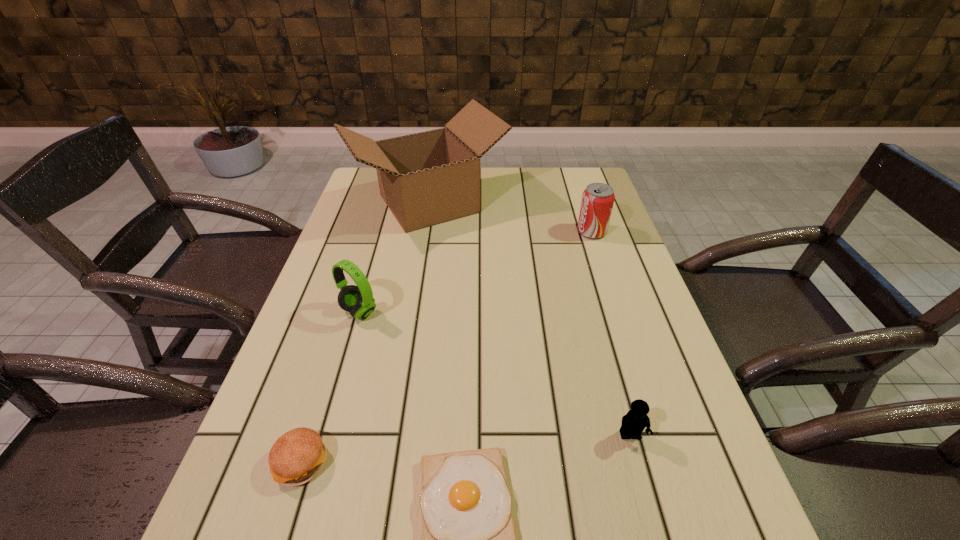
The width and height of the screenshot is (960, 540). In order to click on object positioned at the far edge in this screenshot , I will do `click(428, 178)`.

I want to click on box located at the left edge, so click(x=428, y=178).

You are a GUI agent. You are given a task and a screenshot of the screen. Output one action in this format:
    pyautogui.click(x=<x>, y=<y>)
    Task: Click on the headset that is at the left edge
    The image size is (960, 540).
    Given the screenshot: What is the action you would take?
    click(358, 300)

This screenshot has width=960, height=540. Identify the location of hamburger at the left edge. (297, 456).

Where is `soda can at the right edge`? This screenshot has width=960, height=540. soda can at the right edge is located at coordinates (597, 202).

This screenshot has height=540, width=960. What are the coordinates of `Lego located in the right edge section of the desktop` in the screenshot? It's located at coord(634,422).

The width and height of the screenshot is (960, 540). What are the coordinates of `object present at the far left corner` in the screenshot? It's located at 428,178.

In the image, there is a desktop. Where is `blank space at the far edge`? blank space at the far edge is located at coordinates (525, 171).

This screenshot has height=540, width=960. Identify the location of vacant space at the left edge. (333, 322).

Image resolution: width=960 pixels, height=540 pixels. I want to click on vacant space at the right edge of the desktop, so click(587, 238).